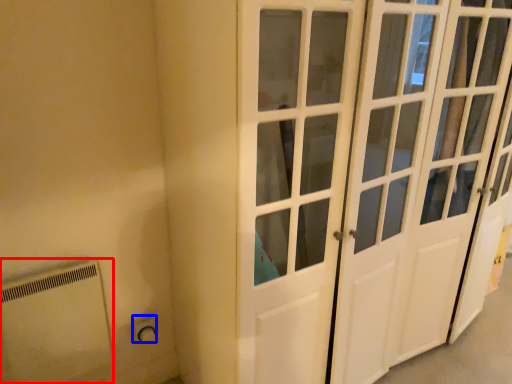
Question: Which object is closer to the camera taking this photo, appliance (highlighted by a red box) or electric outlet (highlighted by a blue box)?

Choices:
 (A) appliance
 (B) electric outlet

Answer: (A)